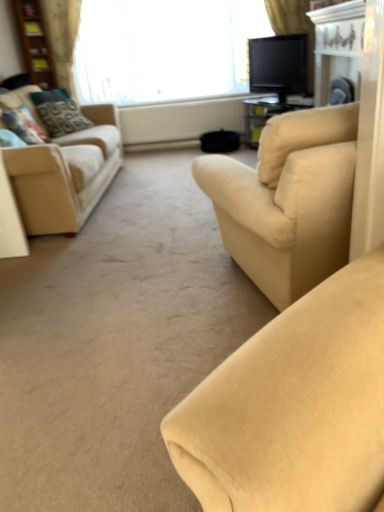
Describe the element at coordinates (178, 122) in the screenshot. I see `white textured radiator at center` at that location.

Identify the location of beige fabric couch at center, which is the 1th studio couch in front-to-back order. This screenshot has width=384, height=512. point(288,200).

I want to click on silky beige curtain at upper center, the 1th curtain when ordered from right to left, so click(289, 16).

Describe the element at coordinates (35, 42) in the screenshot. The image size is (384, 512). I see `wooden bookshelf at upper left` at that location.

Locate an element on the screen. The width and height of the screenshot is (384, 512). white textured radiator at center is located at coordinates (178, 122).

Which object is positioned more to the left, white textured radiator at center or beige fabric couch at left, the 2th studio couch positioned from the right?

beige fabric couch at left, the 2th studio couch positioned from the right.

Are white textured radiator at center and beige fabric couch at left, which appears as the first studio couch when viewed from the back, making contact?

No.

Does white textured radiator at center have a greater width compared to beige fabric couch at left, the 2th studio couch positioned from the right?

Incorrect, the width of white textured radiator at center does not surpass that of beige fabric couch at left, the 2th studio couch positioned from the right.

Is white textured radiator at center shorter than beige fabric couch at left, the 2th studio couch positioned from the right?

Yes, white textured radiator at center is shorter than beige fabric couch at left, the 2th studio couch positioned from the right.

From a real-world perspective, which object rests below the other?

From a 3D spatial view, beige fabric couch at left, the 2th studio couch positioned from the right, is below.

Is patterned fabric pillow at left, the second pillow from the back, oriented towards beige fabric couch at left, the 2th studio couch in the front-to-back sequence?

Yes.

Would you say patterned fabric pillow at left, the second pillow from the back, is inside or outside beige fabric couch at left, which appears as the first studio couch when viewed from the back?

patterned fabric pillow at left, the second pillow from the back, is located inside beige fabric couch at left, which appears as the first studio couch when viewed from the back.

Is patterned fabric pillow at left, the second pillow from the back, not near beige fabric couch at left, the 2th studio couch in the front-to-back sequence?

No, there isn't a large distance between patterned fabric pillow at left, the second pillow from the back, and beige fabric couch at left, the 2th studio couch in the front-to-back sequence.

Is beige fabric couch at left, the 2th studio couch in the front-to-back sequence, aimed at white textured radiator at center?

No, beige fabric couch at left, the 2th studio couch in the front-to-back sequence, is not aimed at white textured radiator at center.

Between beige fabric couch at left, marked as the 1th studio couch in a left-to-right arrangement, and white textured radiator at center, which one has less height?

Standing shorter between the two is white textured radiator at center.

Between beige fabric couch at left, the 2th studio couch positioned from the right, and white textured radiator at center, which one has smaller width?

white textured radiator at center is thinner.

Is patterned fabric pillow at left, the 1th pillow when ordered from front to back, turned away from white textured radiator at center?

No, patterned fabric pillow at left, the 1th pillow when ordered from front to back,'s orientation is not away from white textured radiator at center.

Is patterned fabric pillow at left, the second pillow from the back, further to the viewer compared to white textured radiator at center?

That is False.

In the scene shown: Is patterned fabric pillow at left, the second pillow from the back, next to white textured radiator at center and touching it?

They are not placed beside each other.

Considering the positions of points (206, 183) and (62, 29), is point (206, 183) farther from camera compared to point (62, 29)?

No, (206, 183) is in front of (62, 29).

Can you tell me how much beige fabric couch at center, which is the 2th studio couch from left to right, and beige textured curtain at upper left, the 2th curtain from the right, differ in facing direction?

The angle between the facing direction of beige fabric couch at center, which is the 2th studio couch from left to right, and the facing direction of beige textured curtain at upper left, the 2th curtain from the right, is 162 degrees.

From the picture: Can you see beige fabric couch at center, the 1th studio couch from the right, touching beige textured curtain at upper left, which appears as the 1th curtain when viewed from the left?

No, beige fabric couch at center, the 1th studio couch from the right, is not making contact with beige textured curtain at upper left, which appears as the 1th curtain when viewed from the left.

Considering the points (29, 127) and (50, 96), which point is behind, point (29, 127) or point (50, 96)?

The point (50, 96) is farther.

Can you confirm if patterned fabric pillow at left, the 1th pillow when ordered from front to back, is bigger than patterned fabric pillow at left, placed as the first pillow when sorted from back to front?

Incorrect, patterned fabric pillow at left, the 1th pillow when ordered from front to back, is not larger than patterned fabric pillow at left, placed as the first pillow when sorted from back to front.

Based on the photo, from a real-world perspective, is patterned fabric pillow at left, the second pillow from the back, under patterned fabric pillow at left, placed as the first pillow when sorted from back to front?

No, from a real-world perspective, patterned fabric pillow at left, the second pillow from the back, is not under patterned fabric pillow at left, placed as the first pillow when sorted from back to front.

Is patterned fabric pillow at left, the second pillow from the back, facing towards patterned fabric pillow at left, placed as the first pillow when sorted from back to front?

No.

Is black glossy tv at upper right oriented towards patterned fabric pillow at left, placed as the first pillow when sorted from back to front?

Yes, black glossy tv at upper right is turned towards patterned fabric pillow at left, placed as the first pillow when sorted from back to front.

Which is more to the right, black glossy tv at upper right or patterned fabric pillow at left, the 2th pillow from the front?

Positioned to the right is black glossy tv at upper right.

Is black glossy tv at upper right directly adjacent to patterned fabric pillow at left, the 2th pillow from the front?

No.

Does point (296, 71) come farther from viewer compared to point (45, 121)?

Yes.

This screenshot has height=512, width=384. In order to click on the 1st studio couch in front of the white textured radiator at center, counting from the anchor's position in this screenshot , I will do `click(65, 174)`.

Where is `studio couch that is the 1st object to the right of the patterned fabric pillow at left, the second pillow from the back, starting at the anchor`? The width and height of the screenshot is (384, 512). studio couch that is the 1st object to the right of the patterned fabric pillow at left, the second pillow from the back, starting at the anchor is located at coordinates (65, 174).

Considering their positions, is black glossy tv at upper right positioned closer to beige fabric couch at left, the 2th studio couch positioned from the right, than patterned fabric pillow at left, placed as the first pillow when sorted from back to front?

patterned fabric pillow at left, placed as the first pillow when sorted from back to front.

Estimate the real-world distances between objects in this image. Which object is closer to white textured radiator at center, beige textured curtain at upper left, the 2th curtain from the right, or wooden bookshelf at upper left?

Based on the image, beige textured curtain at upper left, the 2th curtain from the right, appears to be nearer to white textured radiator at center.

Looking at the image, which one is located closer to beige textured curtain at upper left, which appears as the 1th curtain when viewed from the left, patterned fabric pillow at left, the 2th pillow from the front, or black glossy tv at upper right?

Based on the image, patterned fabric pillow at left, the 2th pillow from the front, appears to be nearer to beige textured curtain at upper left, which appears as the 1th curtain when viewed from the left.

Considering their positions, is black glossy tv at upper right positioned further to silky beige curtain at upper center, which is counted as the 2th curtain, starting from the left, than patterned fabric pillow at left, the 1th pillow when ordered from front to back?

patterned fabric pillow at left, the 1th pillow when ordered from front to back, is positioned further to the anchor silky beige curtain at upper center, which is counted as the 2th curtain, starting from the left.

Considering their positions, is beige fabric couch at center, the 1th studio couch from the right, positioned closer to beige fabric couch at left, which appears as the first studio couch when viewed from the back, than beige textured curtain at upper left, which appears as the 1th curtain when viewed from the left?

beige fabric couch at center, the 1th studio couch from the right, lies closer to beige fabric couch at left, which appears as the first studio couch when viewed from the back, than the other object.

Looking at this image, looking at the image, which one is located closer to beige fabric couch at left, marked as the 1th studio couch in a left-to-right arrangement, white glossy fireplace at upper right or patterned fabric pillow at left, the second pillow from the back?

Among the two, patterned fabric pillow at left, the second pillow from the back, is located nearer to beige fabric couch at left, marked as the 1th studio couch in a left-to-right arrangement.

From the picture: Based on their spatial positions, is patterned fabric pillow at left, the second pillow from the back, or black glossy tv at upper right further from beige fabric couch at left, which appears as the first studio couch when viewed from the back?

black glossy tv at upper right lies further to beige fabric couch at left, which appears as the first studio couch when viewed from the back, than the other object.

Consider the image. When comparing their distances from white textured radiator at center, does patterned fabric pillow at left, the second pillow from the back, or silky beige curtain at upper center, which is counted as the 2th curtain, starting from the left, seem closer?

Among the two, silky beige curtain at upper center, which is counted as the 2th curtain, starting from the left, is located nearer to white textured radiator at center.

Locate an element on the screen. The height and width of the screenshot is (512, 384). window situated between wooden bookshelf at upper left and silky beige curtain at upper center, the 1th curtain when ordered from right to left, from left to right is located at coordinates (165, 49).

At what (x,y) coordinates should I click in order to perform the action: click on pillow positioned between patterned fabric pillow at left, the second pillow from the back, and white textured radiator at center from near to far. Please return your answer as a coordinate pair (x, y). The width and height of the screenshot is (384, 512). Looking at the image, I should click on (61, 116).

Locate an element on the screen. The image size is (384, 512). pillow between beige textured curtain at upper left, the 2th curtain from the right, and white textured radiator at center from left to right is located at coordinates (61, 116).

Locate an element on the screen. table between beige fabric couch at center, acting as the 2th studio couch starting from the back, and patterned fabric pillow at left, the 2th pillow from the front, from front to back is located at coordinates (338, 46).